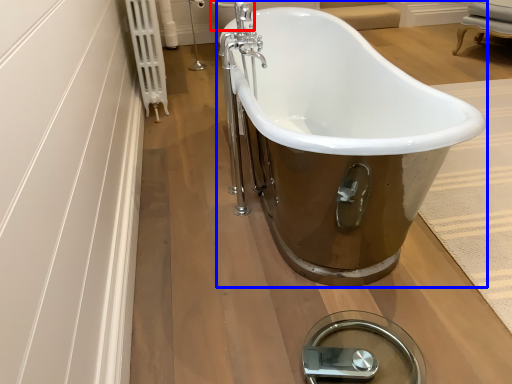
Question: Which of the following is the farthest to the observer, toilet bowl (highlighted by a red box) or bathtub (highlighted by a blue box)?

Choices:
 (A) toilet bowl
 (B) bathtub

Answer: (A)